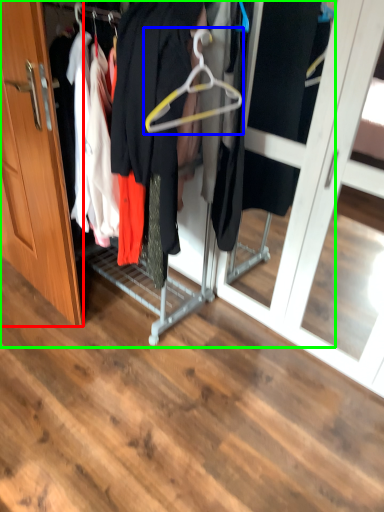
Question: Estimate the real-world distances between objects in this image. Which object is closer to door (highlighted by a red box), hanger (highlighted by a blue box) or closet (highlighted by a green box)?

Choices:
 (A) hanger
 (B) closet

Answer: (B)